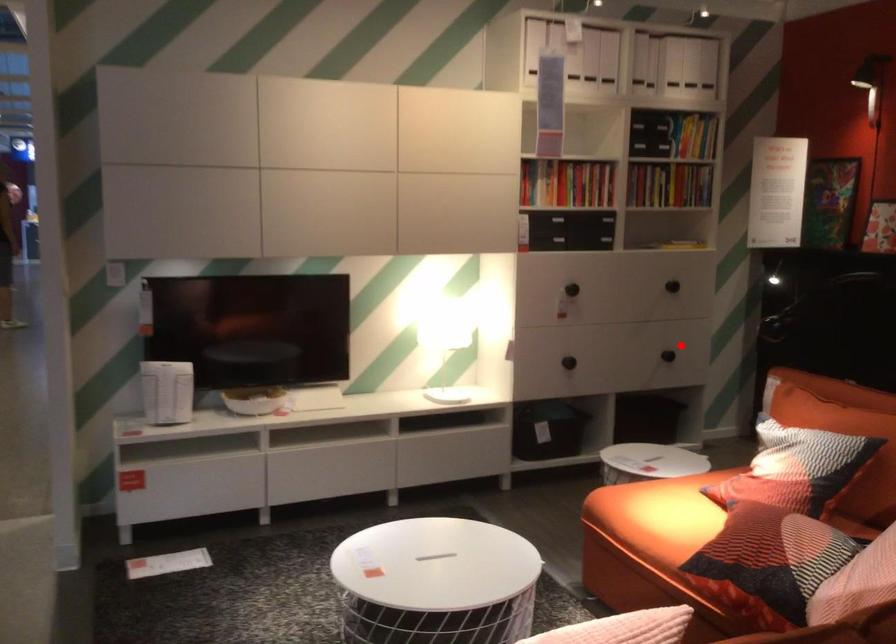
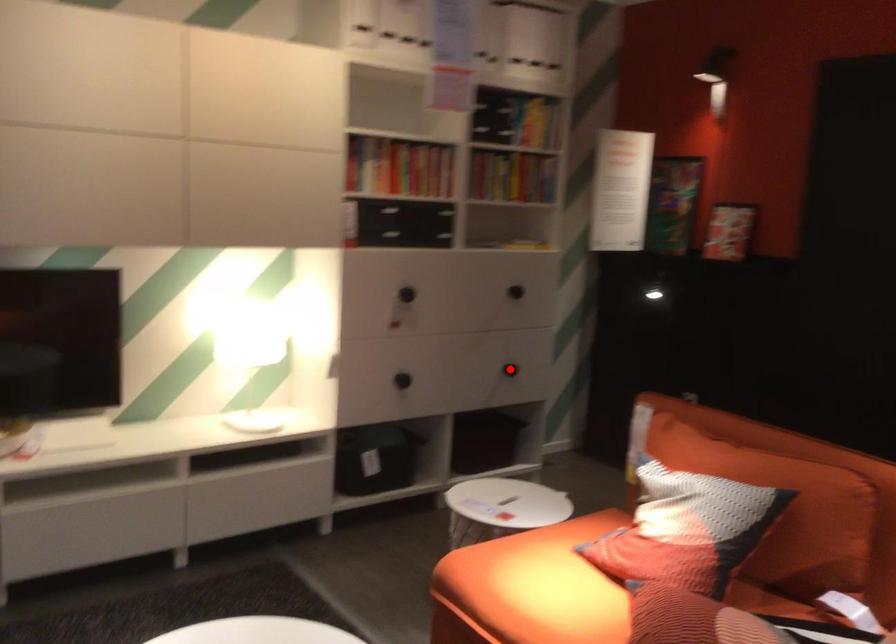
I am providing you with two images of the same scene from different viewpoints. A red point is marked on the first image and another point is marked on the second image. Does the point marked in image1 correspond to the same location as the one in image2?

Yes